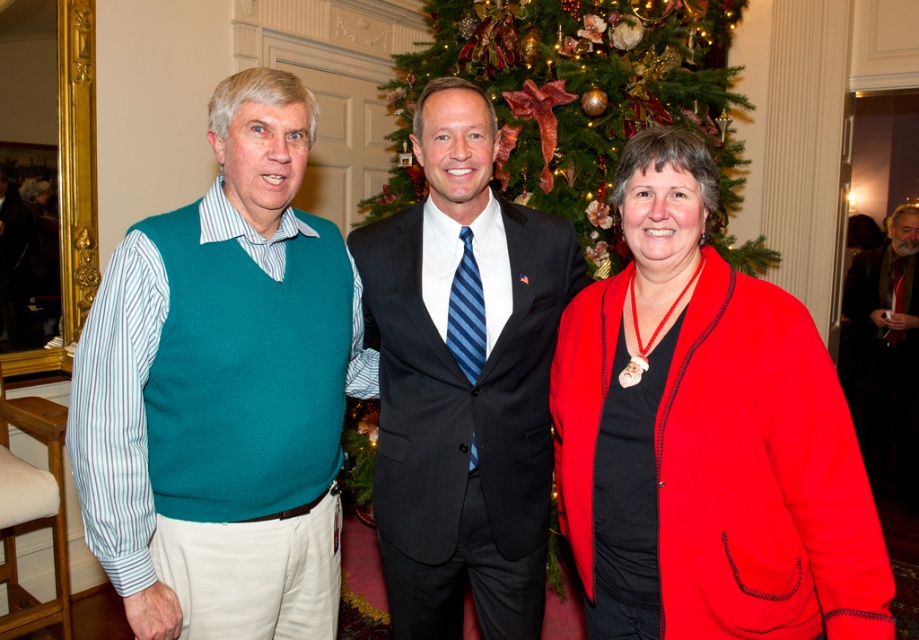
Question: Does matte red jacket at center appear under dark gray suit at center?

Choices:
 (A) yes
 (B) no

Answer: (B)

Question: Which of these objects is positioned farthest from the matte red jacket at center?

Choices:
 (A) teal sweater vest at center
 (B) dark brown leather jacket at center
 (C) dark gray suit at center

Answer: (B)

Question: Which of the following is the farthest from the observer?

Choices:
 (A) teal sweater vest at center
 (B) dark gray suit at center
 (C) green textured christmas tree at center

Answer: (C)

Question: Does teal sweater vest at center come in front of green textured christmas tree at center?

Choices:
 (A) yes
 (B) no

Answer: (A)

Question: Which object is positioned closest to the matte red jacket at center?

Choices:
 (A) teal sweater vest at center
 (B) dark brown leather jacket at center

Answer: (A)

Question: In this image, where is teal sweater vest at center located relative to dark gray suit at center?

Choices:
 (A) left
 (B) right

Answer: (A)